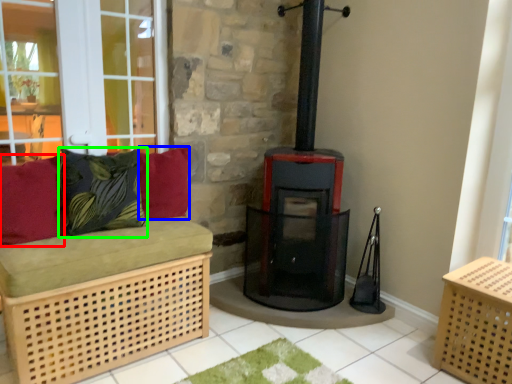
Question: Which is nearer to the pillow (highlighted by a red box)? pillow (highlighted by a blue box) or pillow (highlighted by a green box).

Choices:
 (A) pillow
 (B) pillow

Answer: (B)